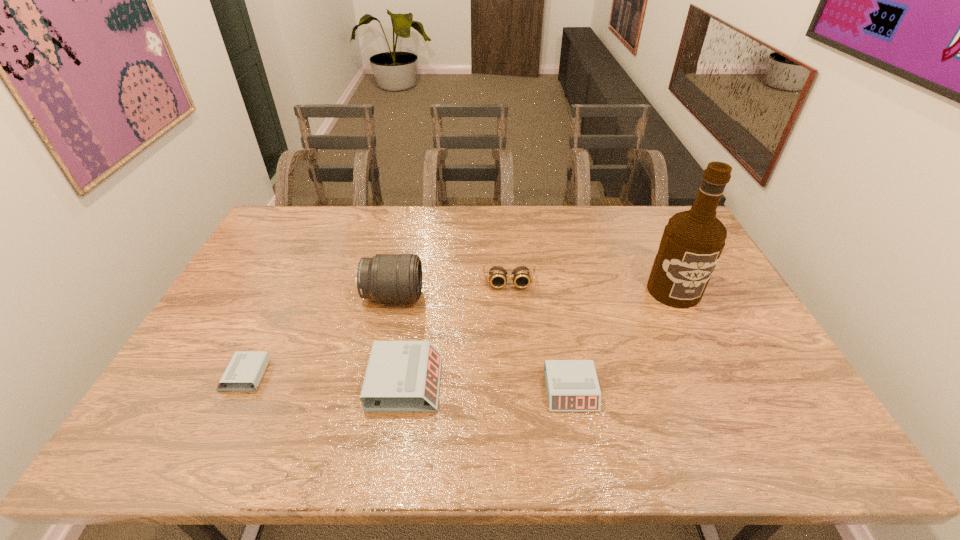
This screenshot has width=960, height=540. I want to click on the leftmost alarm clock, so click(x=244, y=372).

Where is `the shortest object`? The width and height of the screenshot is (960, 540). the shortest object is located at coordinates pyautogui.click(x=244, y=372).

Identify the location of the tallest alarm clock. This screenshot has height=540, width=960. (402, 376).

Where is `the second shortest object`? This screenshot has height=540, width=960. the second shortest object is located at coordinates (572, 385).

Identify the location of the second shortest alarm clock. (572, 385).

What are the coordinates of `goggles` in the screenshot? It's located at (498, 275).

Identify the location of the rightmost object. The image size is (960, 540). (692, 242).

Where is `the tallest object`? The image size is (960, 540). the tallest object is located at coordinates (692, 242).

Locate an element on the screen. The width and height of the screenshot is (960, 540). the second tallest object is located at coordinates (385, 277).

I want to click on free location located 0.120m on the right of the shortest alarm clock, so pos(311,375).